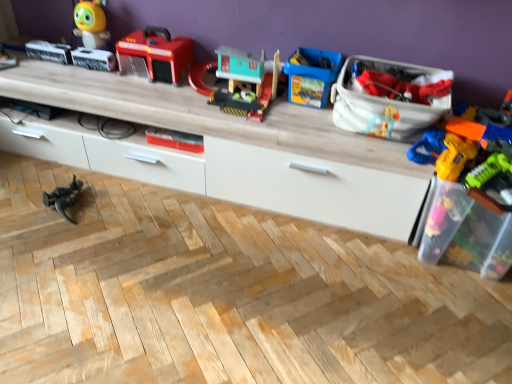
You are a GUI agent. You are given a task and a screenshot of the screen. Output one action in this format:
    pyautogui.click(x=<x>, y=<y>)
    Task: Click on the free region on the left part of black plastic dinosaur at lower left, which is the first toy from left to right
    The image size is (512, 384).
    Given the screenshot: What is the action you would take?
    pyautogui.click(x=28, y=197)